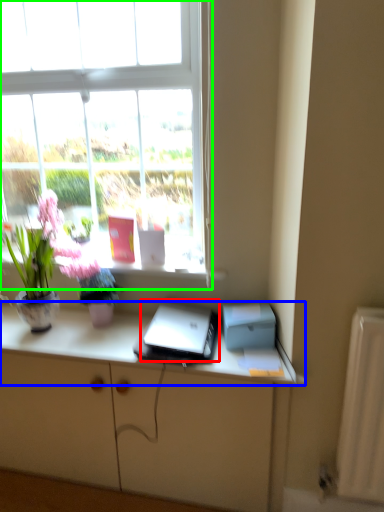
Question: Which is farther away from laptop (highlighted by a red box)? desk (highlighted by a blue box) or window (highlighted by a green box)?

Choices:
 (A) desk
 (B) window

Answer: (B)